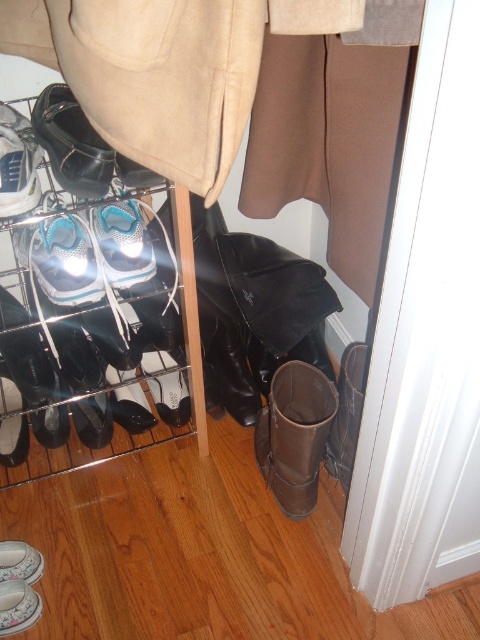
Find the location of `brown leather boot at lower center`. brown leather boot at lower center is located at coordinates (295, 435).

Where is `brown leather boot at lower center`? brown leather boot at lower center is located at coordinates (295, 435).

Does point (64, 216) lie behind point (113, 264)?

Yes.

Is shiny blue leather shoe at lower left closer to camera compared to silver metallic shoe at center?

Yes, shiny blue leather shoe at lower left is closer to the viewer.

Identify the location of shiny blue leather shoe at lower left. (60, 259).

The height and width of the screenshot is (640, 480). I want to click on shiny blue leather shoe at lower left, so click(x=60, y=259).

Is shiny black shoe at left further to camera compared to shiny blue leather shoe at lower left?

No, it is not.

Is shiny black shoe at left taller than shiny blue leather shoe at lower left?

Yes.

You are a GUI agent. You are given a task and a screenshot of the screen. Output one action in this format:
    pyautogui.click(x=<x>, y=<y>)
    Task: Click on the shiny black shoe at left
    This screenshot has height=640, width=480.
    Given the screenshot: What is the action you would take?
    pyautogui.click(x=72, y=144)

Where is `shiny black shoe at left`? This screenshot has height=640, width=480. shiny black shoe at left is located at coordinates (72, 144).